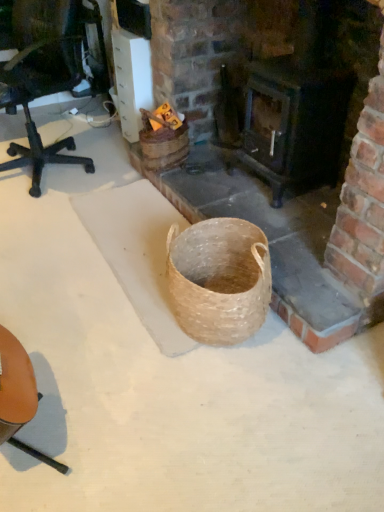
Identify the location of vacant area that lies in front of dark wood stove at center. (291, 216).